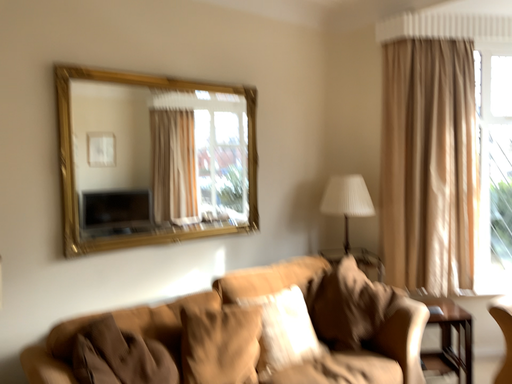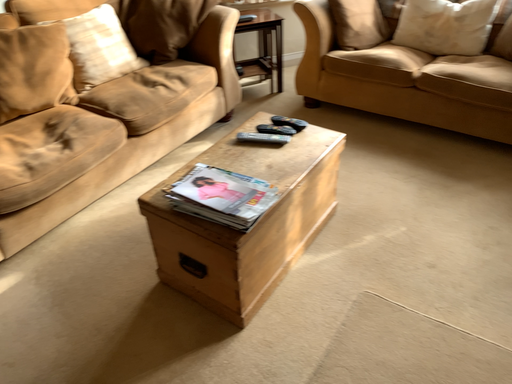
Question: Which way did the camera rotate in the video?

Choices:
 (A) rotated downward
 (B) rotated upward

Answer: (A)